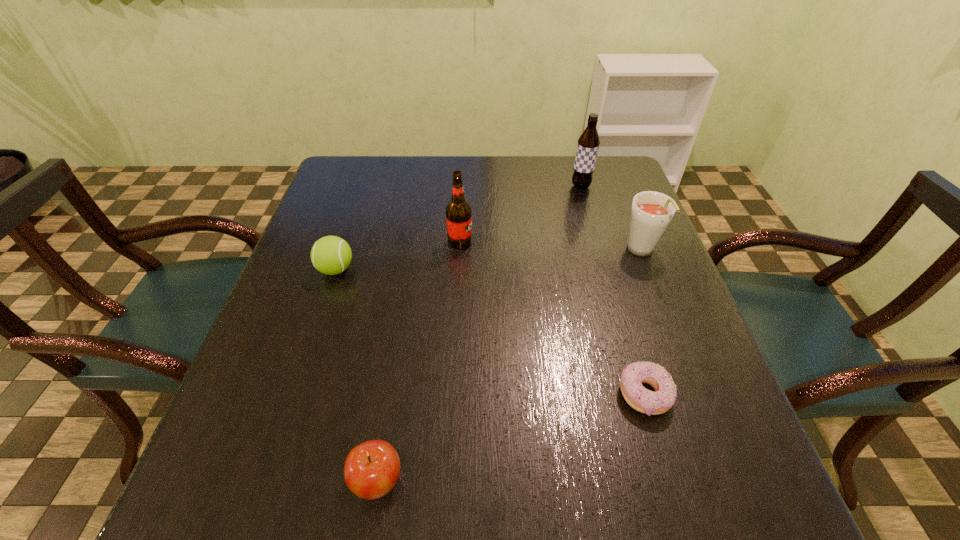
Locate an element on the screen. The image size is (960, 540). unoccupied area between the doughnut and the nearest object is located at coordinates (511, 437).

Identify the location of empty location between the nearest object and the farthest root beer. (479, 333).

This screenshot has width=960, height=540. Find the location of `vacant point located between the apple and the third object from left to right`. vacant point located between the apple and the third object from left to right is located at coordinates [419, 361].

Locate an element on the screen. The height and width of the screenshot is (540, 960). free spot between the apple and the farthest object is located at coordinates (479, 333).

Identify which object is located as the fourth nearest to the shortest object. Please provide its 2D coordinates. Your answer should be formatted as a tuple, i.e. [(x, y)], where the tuple contains the x and y coordinates of a point satisfying the conditions above.

[(331, 255)]

Select which object is the fourth closest to the fourth object from right to left. Please provide its 2D coordinates. Your answer should be formatted as a tuple, i.e. [(x, y)], where the tuple contains the x and y coordinates of a point satisfying the conditions above.

[(641, 399)]

I want to click on root beer that is the closest to the fifth object from right to left, so click(x=458, y=211).

The image size is (960, 540). In order to click on root beer that is the second closest one to the farthest root beer in this screenshot , I will do `click(458, 211)`.

Locate an element on the screen. vacant space that satisfies the following two spatial constraints: 1. on the back side of the farthest object; 2. on the left side of the fifth object from right to left is located at coordinates (424, 186).

At what (x,y) coordinates should I click in order to perform the action: click on free location that satisfies the following two spatial constraints: 1. on the front side of the farthest object; 2. on the right side of the second nearest object. Please return your answer as a coordinate pair (x, y). This screenshot has width=960, height=540. Looking at the image, I should click on (640, 395).